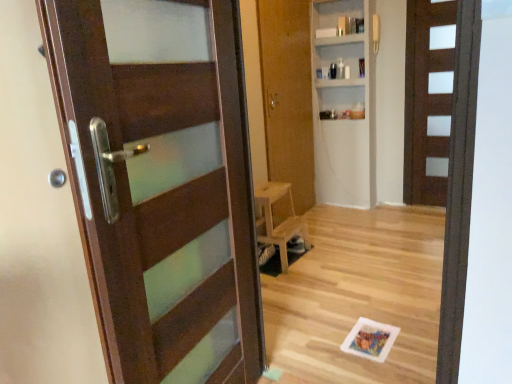
Locate an element on the screen. This screenshot has height=384, width=512. wooden chair at center is located at coordinates (281, 221).

Locate an element on the screen. brown matte door at right, arranged as the third door when viewed from the front is located at coordinates (429, 99).

Considering the sizes of objects white matte bookshelf at upper center and brown matte door at right, which is counted as the 1th door, starting from the right, in the image provided, who is thinner, white matte bookshelf at upper center or brown matte door at right, which is counted as the 1th door, starting from the right,?

With smaller width is brown matte door at right, which is counted as the 1th door, starting from the right.

Between point (357, 179) and point (437, 55), which one is positioned behind?

Point (357, 179)

Is white matte bookshelf at upper center surrounding brown matte door at right, which is counted as the 1th door, starting from the right?

No, brown matte door at right, which is counted as the 1th door, starting from the right, is not surrounded by white matte bookshelf at upper center.

Which object is further away from the camera, wooden door at center, positioned as the second door in right-to-left order, or brown matte door at right, positioned as the 3th door in left-to-right order?

brown matte door at right, positioned as the 3th door in left-to-right order.

From the image's perspective, which object appears higher, wooden door at center, positioned as the second door in right-to-left order, or brown matte door at right, the first door in the back-to-front sequence?

From the image's view, brown matte door at right, the first door in the back-to-front sequence, is above.

From a real-world perspective, which object rests below the other?

brown matte door at right, the first door in the back-to-front sequence, is physically lower.

Considering the relative positions of matte brown door at left, positioned as the 3th door in back-to-front order, and wooden chair at center in the image provided, is matte brown door at left, positioned as the 3th door in back-to-front order, to the right of wooden chair at center from the viewer's perspective?

In fact, matte brown door at left, positioned as the 3th door in back-to-front order, is to the left of wooden chair at center.

Is the depth of matte brown door at left, positioned as the 3th door in back-to-front order, less than that of wooden chair at center?

Yes, matte brown door at left, positioned as the 3th door in back-to-front order, is in front of wooden chair at center.

From a real-world perspective, is matte brown door at left, acting as the 1th door starting from the front, physically located above or below wooden chair at center?

In terms of real-world spatial position, matte brown door at left, acting as the 1th door starting from the front, is above wooden chair at center.

From the image's perspective, is matte brown door at left, positioned as the 3th door in back-to-front order, below wooden chair at center?

Actually, matte brown door at left, positioned as the 3th door in back-to-front order, appears above wooden chair at center in the image.

Based on the photo, is brown matte door at right, the first door in the back-to-front sequence, facing towards white matte bookshelf at upper center?

No, brown matte door at right, the first door in the back-to-front sequence, is not facing towards white matte bookshelf at upper center.

Find the location of a particular element. This screenshot has width=512, height=384. bookshelf on the left of brown matte door at right, positioned as the 3th door in left-to-right order is located at coordinates coord(344,108).

From a real-world perspective, is brown matte door at right, arranged as the third door when viewed from the front, positioned above or below white matte bookshelf at upper center?

From a real-world perspective, brown matte door at right, arranged as the third door when viewed from the front, is physically below white matte bookshelf at upper center.

Looking at this image, can you confirm if brown matte door at right, arranged as the third door when viewed from the front, is thinner than white matte bookshelf at upper center?

Correct, the width of brown matte door at right, arranged as the third door when viewed from the front, is less than that of white matte bookshelf at upper center.

Is point (412, 150) closer or farther from the camera than point (265, 236)?

Point (412, 150) is positioned farther from the camera compared to point (265, 236).

Consider the image. Is brown matte door at right, the first door in the back-to-front sequence, positioned beyond the bounds of wooden chair at center?

brown matte door at right, the first door in the back-to-front sequence, lies outside wooden chair at center's area.

Is brown matte door at right, arranged as the third door when viewed from the front, closer to camera compared to wooden chair at center?

No, brown matte door at right, arranged as the third door when viewed from the front, is further to the viewer.

Is the surface of brown matte door at right, the first door in the back-to-front sequence, in direct contact with wooden chair at center?

brown matte door at right, the first door in the back-to-front sequence, and wooden chair at center are clearly separated.

Which is behind, point (260, 53) or point (290, 208)?

The point (290, 208) is more distant.

Which of these two, wooden door at center, which ranks as the 2th door in front-to-back order, or wooden chair at center, is thinner?

wooden door at center, which ranks as the 2th door in front-to-back order, is thinner.

Can you confirm if wooden door at center, which ranks as the second door in left-to-right order, is positioned to the left of wooden chair at center?

No, wooden door at center, which ranks as the second door in left-to-right order, is not to the left of wooden chair at center.

Considering their positions, is wooden door at center, which ranks as the 2th door in front-to-back order, located in front of or behind wooden chair at center?

In the image, wooden door at center, which ranks as the 2th door in front-to-back order, appears behind wooden chair at center.

Considering the sizes of objects matte brown door at left, positioned as the 3th door in back-to-front order, and brown matte door at right, positioned as the 3th door in left-to-right order, in the image provided, who is thinner, matte brown door at left, positioned as the 3th door in back-to-front order, or brown matte door at right, positioned as the 3th door in left-to-right order,?

Thinner between the two is brown matte door at right, positioned as the 3th door in left-to-right order.

Which object is closer to the camera taking this photo, matte brown door at left, positioned as the 3th door in back-to-front order, or brown matte door at right, which is counted as the 1th door, starting from the right?

matte brown door at left, positioned as the 3th door in back-to-front order.

Is matte brown door at left, positioned as the 1th door in left-to-right order, outside of brown matte door at right, positioned as the 3th door in left-to-right order?

matte brown door at left, positioned as the 1th door in left-to-right order, lies outside brown matte door at right, positioned as the 3th door in left-to-right order,'s area.

Find the location of a particular element. The width and height of the screenshot is (512, 384). door on the right of white matte bookshelf at upper center is located at coordinates (429, 99).

I want to click on door lying behind the wooden door at center, which ranks as the second door in left-to-right order, so click(x=429, y=99).

Which object lies nearer to the anchor point wooden chair at center, brown matte door at right, which is counted as the 1th door, starting from the right, or matte brown door at left, acting as the 1th door starting from the front?

matte brown door at left, acting as the 1th door starting from the front, is positioned closer to the anchor wooden chair at center.

Considering their positions, is white matte bookshelf at upper center positioned further to matte brown door at left, positioned as the third door in right-to-left order, than brown matte door at right, the first door in the back-to-front sequence?

Based on the image, brown matte door at right, the first door in the back-to-front sequence, appears to be further to matte brown door at left, positioned as the third door in right-to-left order.

Based on their spatial positions, is white matte bookshelf at upper center or wooden door at center, which ranks as the 2th door in front-to-back order, further from wooden chair at center?

The object further to wooden chair at center is white matte bookshelf at upper center.

Looking at the image, which one is located further to wooden door at center, the second door positioned from the back, wooden chair at center or matte brown door at left, acting as the 1th door starting from the front?

matte brown door at left, acting as the 1th door starting from the front, is further to wooden door at center, the second door positioned from the back.

Looking at the image, which one is located further to wooden door at center, positioned as the second door in right-to-left order, white matte bookshelf at upper center or wooden chair at center?

wooden chair at center lies further to wooden door at center, positioned as the second door in right-to-left order, than the other object.

From the image, which object appears to be farther from matte brown door at left, acting as the 1th door starting from the front, wooden chair at center or brown matte door at right, arranged as the third door when viewed from the front?

brown matte door at right, arranged as the third door when viewed from the front.

When comparing their distances from wooden chair at center, does matte brown door at left, acting as the 1th door starting from the front, or brown matte door at right, positioned as the 3th door in left-to-right order, seem closer?

matte brown door at left, acting as the 1th door starting from the front.

Estimate the real-world distances between objects in this image. Which object is further from brown matte door at right, arranged as the third door when viewed from the front, wooden door at center, which ranks as the 2th door in front-to-back order, or white matte bookshelf at upper center?

wooden door at center, which ranks as the 2th door in front-to-back order, is further to brown matte door at right, arranged as the third door when viewed from the front.

Identify the location of door between matte brown door at left, positioned as the 3th door in back-to-front order, and brown matte door at right, arranged as the third door when viewed from the front, in the front-back direction. The image size is (512, 384). 287,95.

At what (x,y) coordinates should I click in order to perform the action: click on furniture located between matte brown door at left, positioned as the 3th door in back-to-front order, and wooden door at center, positioned as the second door in right-to-left order, in the depth direction. Please return your answer as a coordinate pair (x, y). This screenshot has height=384, width=512. Looking at the image, I should click on (281, 221).

At what (x,y) coordinates should I click in order to perform the action: click on furniture between matte brown door at left, acting as the 1th door starting from the front, and brown matte door at right, arranged as the third door when viewed from the front, from front to back. Please return your answer as a coordinate pair (x, y). This screenshot has width=512, height=384. Looking at the image, I should click on (281, 221).

At what (x,y) coordinates should I click in order to perform the action: click on door located between wooden chair at center and brown matte door at right, positioned as the 3th door in left-to-right order, in the left-right direction. Please return your answer as a coordinate pair (x, y). The image size is (512, 384). Looking at the image, I should click on pyautogui.click(x=287, y=95).